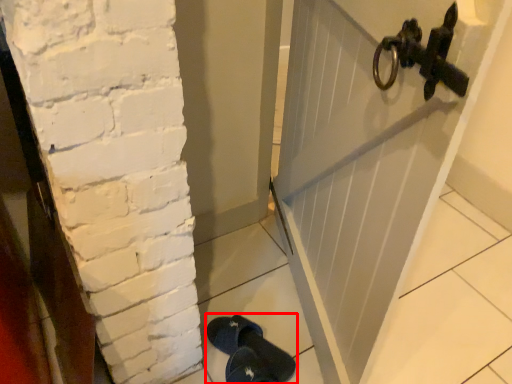
Question: From the image's perspective, considering the relative positions of footwear (annotated by the red box) and door in the image provided, where is footwear (annotated by the red box) located with respect to the staircase?

Choices:
 (A) below
 (B) above

Answer: (A)